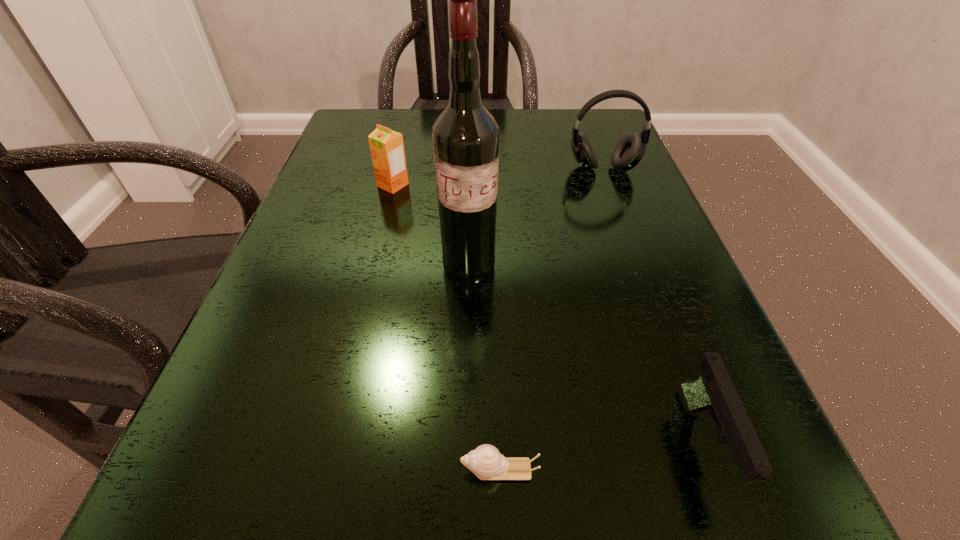
Image resolution: width=960 pixels, height=540 pixels. In order to click on object present at the near right corner in this screenshot , I will do `click(713, 392)`.

Find the location of a particular element. The image size is (960, 540). vacant space at the far edge of the desktop is located at coordinates (503, 119).

I want to click on vacant point at the near edge, so click(x=494, y=537).

Where is `vacant space at the left edge of the desktop`? The height and width of the screenshot is (540, 960). vacant space at the left edge of the desktop is located at coordinates [x=323, y=298].

Identify the location of vacant space at the right edge of the desktop. (676, 316).

This screenshot has height=540, width=960. I want to click on free region at the far left corner of the desktop, so click(x=379, y=118).

I want to click on vacant space at the far right corner of the desktop, so click(x=596, y=116).

What are the coordinates of `free spot between the fourth tallest object and the shortest object` in the screenshot? It's located at (601, 456).

You are a GUI agent. You are given a task and a screenshot of the screen. Output one action in this format:
    pyautogui.click(x=<x>, y=<y>)
    Task: Click on the vacant space in between the pistol and the shortest object
    The image size is (960, 540).
    Given the screenshot: What is the action you would take?
    pyautogui.click(x=601, y=456)

You are a GUI agent. You are given a task and a screenshot of the screen. Output one action in this format:
    pyautogui.click(x=<x>, y=<y>)
    Task: Click on the free space between the wine bottle and the pistol
    The width and height of the screenshot is (960, 540).
    Given the screenshot: What is the action you would take?
    pyautogui.click(x=586, y=355)